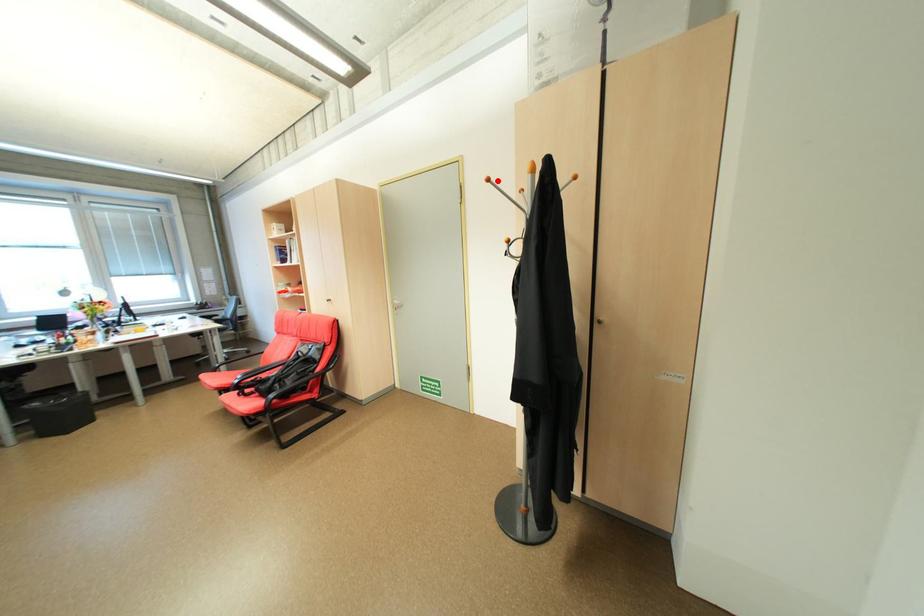
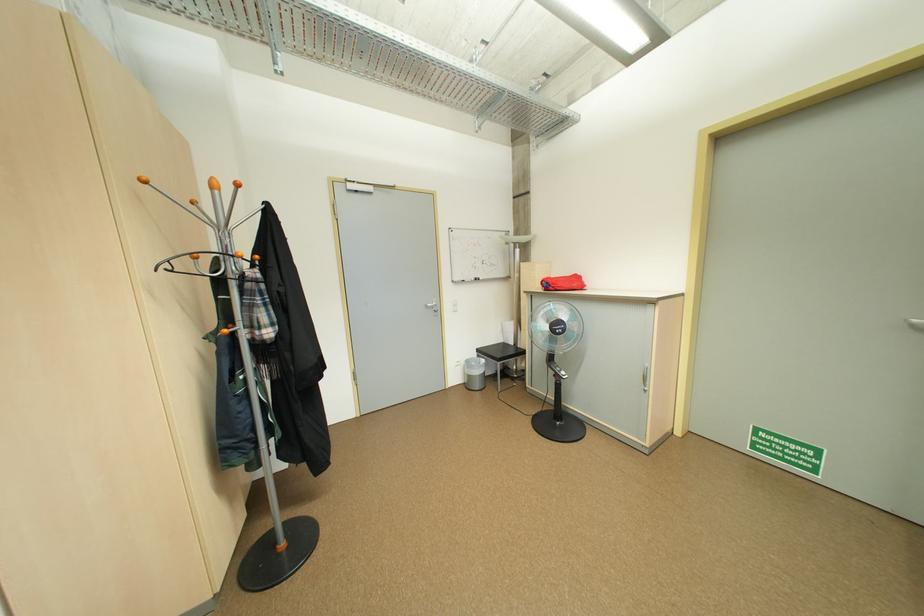
Find the pixel in the second image that matches the highlighted location in the first image.

(247, 185)